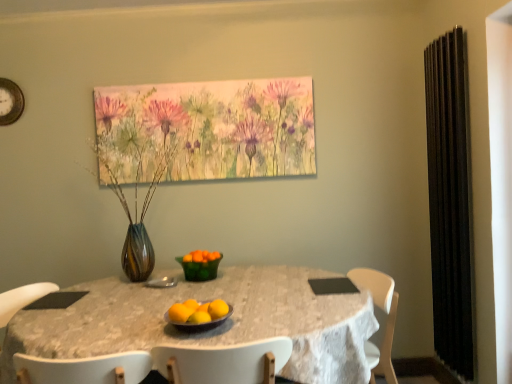
Question: Should I look upward or downward to see orange matte at center, which appears as the second orange when viewed from the front?

Choices:
 (A) up
 (B) down

Answer: (B)

Question: From the image's perspective, would you say shiny metallic bowl at center is shown under gold metallic clock at upper left?

Choices:
 (A) yes
 (B) no

Answer: (A)

Question: Can you confirm if shiny metallic bowl at center is thinner than gold metallic clock at upper left?

Choices:
 (A) no
 (B) yes

Answer: (A)

Question: Is shiny metallic bowl at center located outside gold metallic clock at upper left?

Choices:
 (A) no
 (B) yes

Answer: (B)

Question: Does shiny metallic bowl at center appear on the left side of gold metallic clock at upper left?

Choices:
 (A) no
 (B) yes

Answer: (A)

Question: Is shiny metallic bowl at center next to gold metallic clock at upper left?

Choices:
 (A) no
 (B) yes

Answer: (A)

Question: From a real-world perspective, is shiny metallic bowl at center on gold metallic clock at upper left?

Choices:
 (A) yes
 (B) no

Answer: (B)

Question: Does watercolor flowers at upper center appear on the right side of orange matte at center, which appears as the second orange when viewed from the back?

Choices:
 (A) yes
 (B) no

Answer: (B)

Question: Is watercolor flowers at upper center outside of orange matte at center, which appears as the second orange when viewed from the back?

Choices:
 (A) no
 (B) yes

Answer: (B)

Question: Is watercolor flowers at upper center oriented away from orange matte at center, the 3th orange viewed from the left?

Choices:
 (A) yes
 (B) no

Answer: (B)

Question: Can you confirm if watercolor flowers at upper center is shorter than orange matte at center, which appears as the second orange when viewed from the back?

Choices:
 (A) yes
 (B) no

Answer: (B)

Question: Is watercolor flowers at upper center surrounding orange matte at center, which appears as the second orange when viewed from the front?

Choices:
 (A) yes
 (B) no

Answer: (B)

Question: Could you tell me if watercolor flowers at upper center is facing orange matte at center, which appears as the second orange when viewed from the back?

Choices:
 (A) no
 (B) yes

Answer: (A)

Question: Is white lace tablecloth at center not close to gold metallic clock at upper left?

Choices:
 (A) yes
 (B) no

Answer: (A)